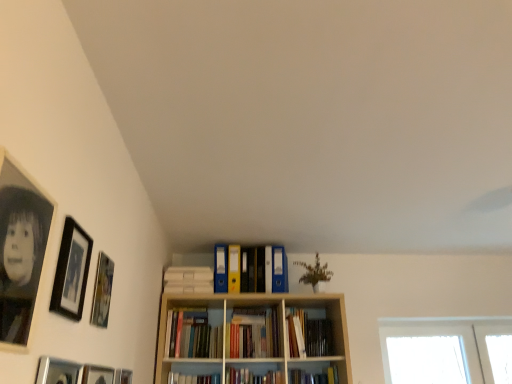
Question: Which direction should I rotate to look at matte plastic folders at center, the 3th book in the bottom-to-top sequence?

Choices:
 (A) right
 (B) left

Answer: (A)

Question: From the image's perspective, is matte plastic folders at center, the 3th book in the bottom-to-top sequence, over matte black picture frame at lower left, the 3th picture frame positioned from the back?

Choices:
 (A) yes
 (B) no

Answer: (A)

Question: Does matte plastic folders at center, the 3th book in the bottom-to-top sequence, have a smaller size compared to matte black picture frame at lower left, the 3th picture frame positioned from the back?

Choices:
 (A) yes
 (B) no

Answer: (B)

Question: Would you say matte plastic folders at center, the first book in the top-to-bottom sequence, is outside matte black picture frame at lower left, the fourth picture frame when ordered from front to back?

Choices:
 (A) yes
 (B) no

Answer: (A)

Question: Is matte plastic folders at center, the 3th book in the bottom-to-top sequence, aimed at matte black picture frame at lower left, the 3th picture frame positioned from the back?

Choices:
 (A) no
 (B) yes

Answer: (A)

Question: Is matte plastic folders at center, the first book in the top-to-bottom sequence, closer to the viewer compared to matte black picture frame at lower left, the 3th picture frame positioned from the back?

Choices:
 (A) no
 (B) yes

Answer: (A)

Question: Can you confirm if matte plastic folders at center, the first book in the top-to-bottom sequence, is taller than matte black picture frame at lower left, the fourth picture frame when ordered from front to back?

Choices:
 (A) yes
 (B) no

Answer: (B)

Question: Is hardcover books at center, the 2th book when ordered from bottom to top, bigger than metallic silver picture frame at lower left, the fifth picture frame in the back-to-front sequence?

Choices:
 (A) no
 (B) yes

Answer: (B)

Question: Does hardcover books at center, placed as the 2th book when sorted from top to bottom, have a lesser width compared to metallic silver picture frame at lower left, the fifth picture frame in the back-to-front sequence?

Choices:
 (A) yes
 (B) no

Answer: (B)

Question: Are hardcover books at center, placed as the 2th book when sorted from top to bottom, and metallic silver picture frame at lower left, arranged as the 2th picture frame when viewed from the front, far apart?

Choices:
 (A) yes
 (B) no

Answer: (A)

Question: Is hardcover books at center, placed as the 2th book when sorted from top to bottom, positioned before metallic silver picture frame at lower left, the fifth picture frame in the back-to-front sequence?

Choices:
 (A) no
 (B) yes

Answer: (A)

Question: From the image's perspective, is hardcover books at center, the 2th book when ordered from bottom to top, over metallic silver picture frame at lower left, the fifth picture frame in the back-to-front sequence?

Choices:
 (A) yes
 (B) no

Answer: (B)

Question: Does hardcover books at center, the 2th book when ordered from bottom to top, lie behind metallic silver picture frame at lower left, the fifth picture frame in the back-to-front sequence?

Choices:
 (A) yes
 (B) no

Answer: (A)

Question: Is black matte picture frame at upper left, placed as the 4th picture frame when sorted from back to front, not inside matte plastic folders at center, the 3th book in the bottom-to-top sequence?

Choices:
 (A) no
 (B) yes

Answer: (B)